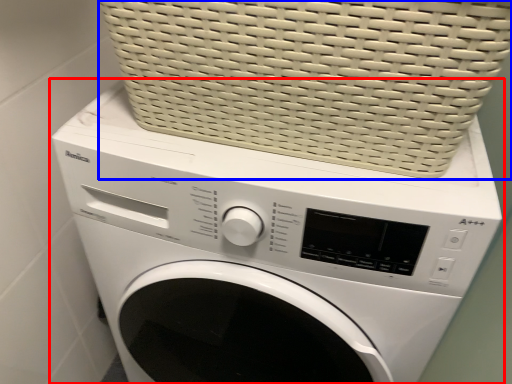
Question: Which object appears closest to the camera in this image, washing machine (highlighted by a red box) or basket (highlighted by a blue box)?

Choices:
 (A) washing machine
 (B) basket

Answer: (B)